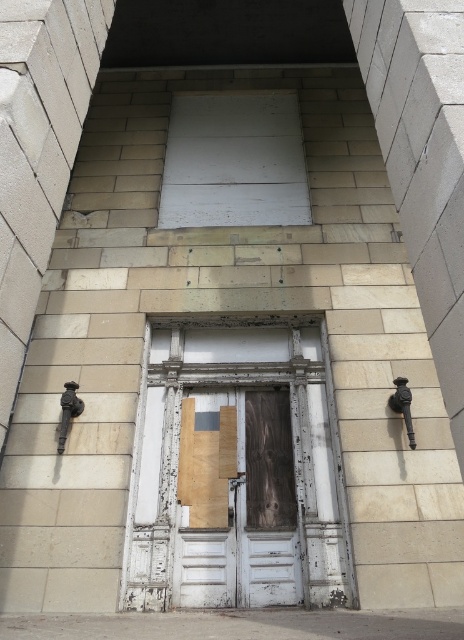
Question: Observing the image, what is the correct spatial positioning of wooden door at center in reference to white matte board at upper center?

Choices:
 (A) right
 (B) left

Answer: (A)

Question: Which point is farther to the camera?

Choices:
 (A) wooden door at center
 (B) white matte board at upper center

Answer: (B)

Question: Can you confirm if wooden door at center is positioned to the left of white matte board at upper center?

Choices:
 (A) no
 (B) yes

Answer: (A)

Question: Is wooden door at center to the left of white matte board at upper center from the viewer's perspective?

Choices:
 (A) yes
 (B) no

Answer: (B)